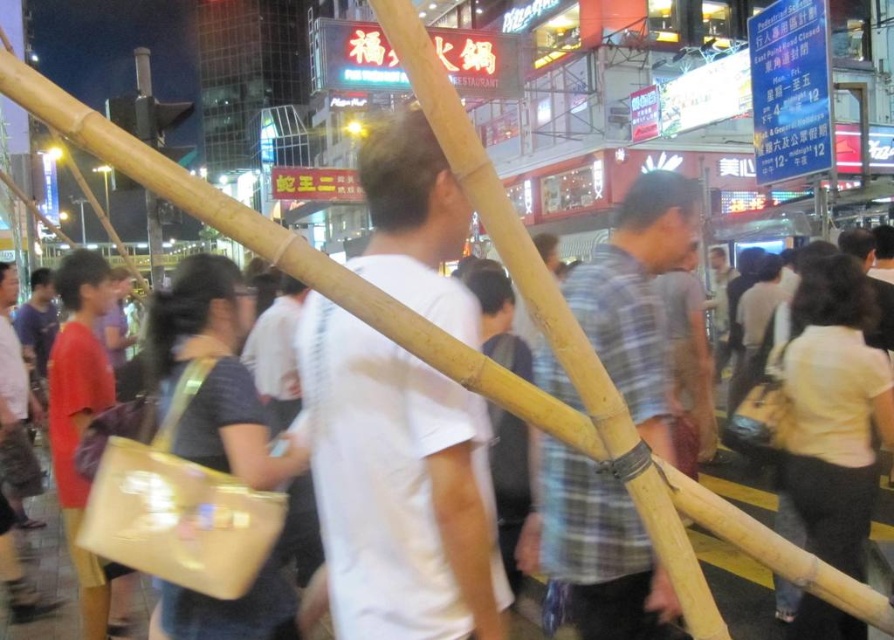
You are a delivery person standing at the edge of the scene. You need to place a package between the plaid fabric shirt at center and the natural bamboo pole at center. Is there enough space to fit the package, which is 1 meter long?

The distance between the plaid fabric shirt at center and the natural bamboo pole at center is 9.20 feet. Converting feet to meters, 9.20 feet is approximately 2.8 meters. Since the package is 1 meter long, there is sufficient space to place it between them.